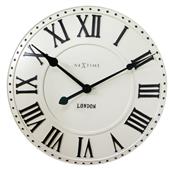
The height and width of the screenshot is (170, 174). I want to click on white clock, so click(x=112, y=31).